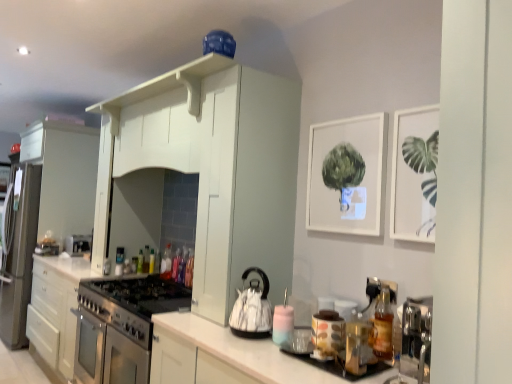
Question: Considering the relative sizes of translucent plastic bottle at center, the 3th bottle viewed from the back, and white matte cabinet at upper center, which appears as the second cabinetry when viewed from the right, in the image provided, is translucent plastic bottle at center, the 3th bottle viewed from the back, smaller than white matte cabinet at upper center, which appears as the second cabinetry when viewed from the right,?

Choices:
 (A) no
 (B) yes

Answer: (B)

Question: Is translucent plastic bottle at center, which is counted as the 1th bottle, starting from the left, bigger than white matte cabinet at upper center, positioned as the 2th cabinetry in left-to-right order?

Choices:
 (A) no
 (B) yes

Answer: (A)

Question: From the image's perspective, would you say translucent plastic bottle at center, which is counted as the 1th bottle, starting from the left, is shown under white matte cabinet at upper center, positioned as the 2th cabinetry in left-to-right order?

Choices:
 (A) no
 (B) yes

Answer: (B)

Question: Does translucent plastic bottle at center, the 3th bottle viewed from the back, have a greater height compared to white matte cabinet at upper center, marked as the second cabinetry in a front-to-back arrangement?

Choices:
 (A) no
 (B) yes

Answer: (A)

Question: Is translucent plastic bottle at center, arranged as the 9th bottle when viewed from the right, wider than white matte cabinet at upper center, marked as the second cabinetry in a front-to-back arrangement?

Choices:
 (A) yes
 (B) no

Answer: (B)

Question: Looking at their shapes, would you say translucent glass bottle at right, which is counted as the ninth bottle, starting from the left, is wider or thinner than white matte picture frame at upper center, the second picture frame in the right-to-left sequence?

Choices:
 (A) wide
 (B) thin

Answer: (A)

Question: From the image's perspective, is translucent glass bottle at right, which appears as the 1th bottle when viewed from the right, located above or below white matte picture frame at upper center, the first picture frame viewed from the back?

Choices:
 (A) above
 (B) below

Answer: (B)

Question: Looking at the image, does translucent glass bottle at right, which is the 8th bottle in back-to-front order, seem bigger or smaller compared to white matte picture frame at upper center, which is counted as the second picture frame, starting from the front?

Choices:
 (A) small
 (B) big

Answer: (A)

Question: From a real-world perspective, relative to white matte picture frame at upper center, which is counted as the second picture frame, starting from the front, is translucent glass bottle at right, the 2th bottle in the front-to-back sequence, vertically above or below?

Choices:
 (A) below
 (B) above

Answer: (A)

Question: Is translucent plastic bottle at center, positioned as the sixth bottle in right-to-left order, bigger or smaller than translucent plastic bottle at center, placed as the sixth bottle when sorted from back to front?

Choices:
 (A) big
 (B) small

Answer: (A)

Question: In the image, is translucent plastic bottle at center, which ranks as the sixth bottle in front-to-back order, on the left side or the right side of translucent plastic bottle at center, placed as the sixth bottle when sorted from back to front?

Choices:
 (A) left
 (B) right

Answer: (A)

Question: From their relative heights in the image, would you say translucent plastic bottle at center, which ranks as the sixth bottle in front-to-back order, is taller or shorter than translucent plastic bottle at center, acting as the 4th bottle starting from the front?

Choices:
 (A) short
 (B) tall

Answer: (B)

Question: Looking at their shapes, would you say translucent plastic bottle at center, which ranks as the sixth bottle in front-to-back order, is wider or thinner than translucent plastic bottle at center, arranged as the fourth bottle when viewed from the right?

Choices:
 (A) wide
 (B) thin

Answer: (A)

Question: Would you say matte ceramic jar at center, which ranks as the first appliance in front-to-back order, is to the left or to the right of translucent plastic bottle at center, which appears as the 5th bottle when viewed from the back, in the picture?

Choices:
 (A) left
 (B) right

Answer: (B)

Question: Relative to translucent plastic bottle at center, which is the fifth bottle from front to back, is matte ceramic jar at center, which ranks as the 2th appliance in left-to-right order, in front or behind?

Choices:
 (A) behind
 (B) front

Answer: (B)